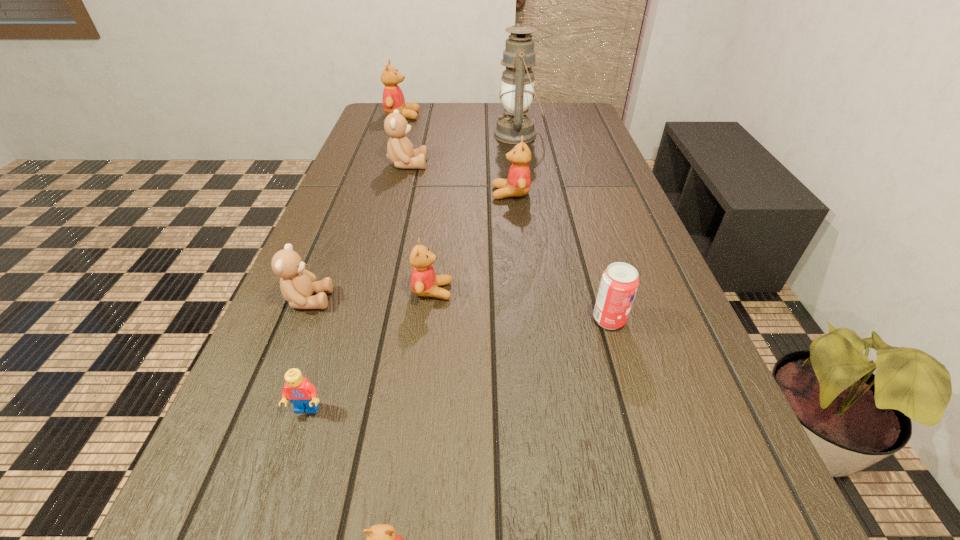
Identify the location of free region located on the face of the smaller brown teddy bear. This screenshot has width=960, height=540. (387, 300).

Identify the location of free space located on the front of the rightmost object. (655, 475).

Identify the location of free location located 0.160m on the face of the Lego. (267, 533).

You are a GUI agent. You are given a task and a screenshot of the screen. Output one action in this format:
    pyautogui.click(x=<x>, y=<y>)
    Task: Click on the oil lamp that is at the far edge
    This screenshot has width=960, height=540.
    Given the screenshot: What is the action you would take?
    pyautogui.click(x=517, y=90)

Identify the location of teddy bear situated at the far edge. (393, 99).

At what (x,y) coordinates should I click in order to perform the action: click on Lego present at the left edge. Please return your answer as a coordinate pair (x, y). This screenshot has width=960, height=540. Looking at the image, I should click on (302, 394).

Locate an element on the screen. Image resolution: width=960 pixels, height=540 pixels. object located in the right edge section of the desktop is located at coordinates (619, 282).

Image resolution: width=960 pixels, height=540 pixels. I want to click on object at the far left corner, so click(x=393, y=99).

In the image, there is a desktop. Where is `blank space at the far edge`? blank space at the far edge is located at coordinates (471, 122).

Locate an element on the screen. The width and height of the screenshot is (960, 540). vacant space at the left edge of the desktop is located at coordinates (326, 393).